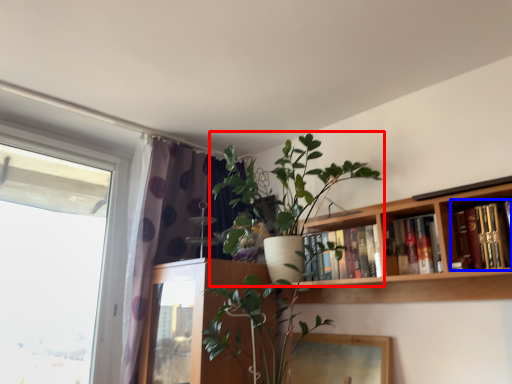
Question: Which of the following is the farthest to the observer, houseplant (highlighted by a red box) or book (highlighted by a blue box)?

Choices:
 (A) houseplant
 (B) book

Answer: (A)